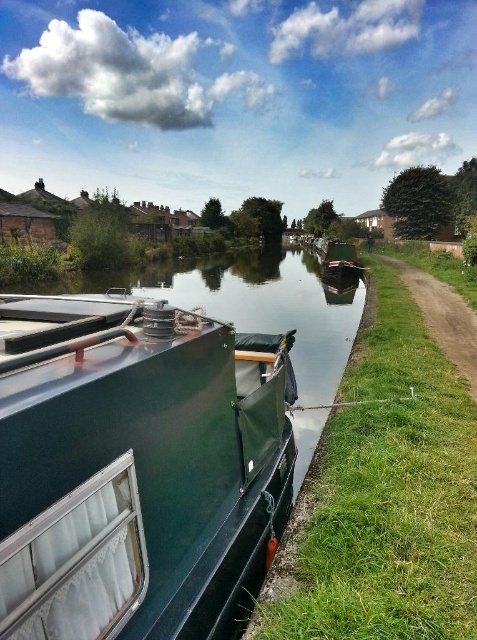
Question: Is green glossy boat at center to the right of green matte boat at center from the viewer's perspective?

Choices:
 (A) no
 (B) yes

Answer: (A)

Question: Which of the following is the farthest from the observer?

Choices:
 (A) green matte boat at lower left
 (B) dirt path at right
 (C) green glossy boat at center

Answer: (B)

Question: Considering the real-world distances, which object is farthest from the green matte boat at center?

Choices:
 (A) green rubber boat at center
 (B) dirt path at right
 (C) green glossy boat at center

Answer: (A)

Question: Is green glossy boat at center to the right of dirt path at right from the viewer's perspective?

Choices:
 (A) no
 (B) yes

Answer: (A)

Question: Which of the following is the farthest from the observer?

Choices:
 (A) (328, 248)
 (B) (256, 360)
 (C) (343, 307)

Answer: (A)

Question: From the image, what is the correct spatial relationship of green rubber boat at center in relation to dirt path at right?

Choices:
 (A) below
 (B) above

Answer: (A)